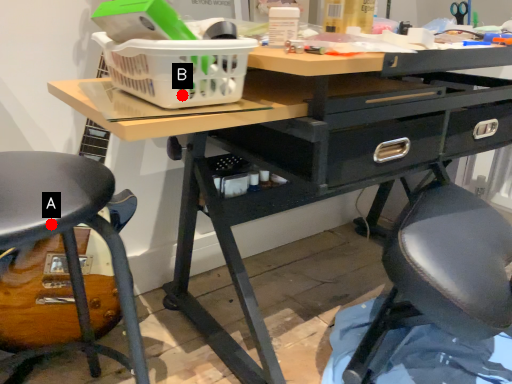
Question: Two points are circled on the image, labeled by A and B beside each circle. Among these points, which one is nearest to the camera?

Choices:
 (A) A is closer
 (B) B is closer

Answer: (B)